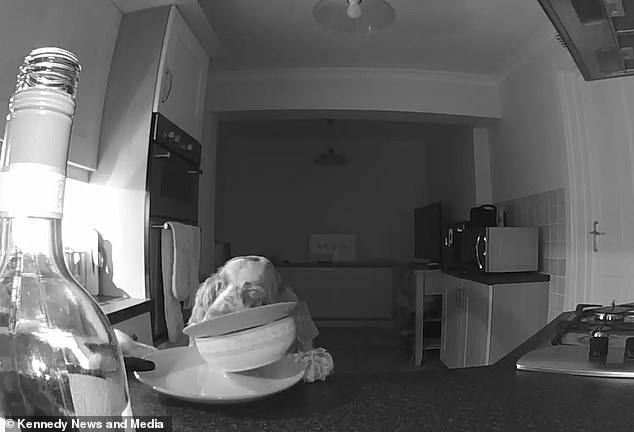
What are the coordinates of `white towel hanging on owen` in the screenshot? It's located at (184, 253).